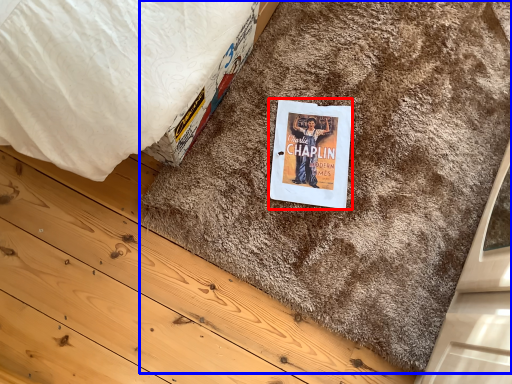
Question: Which of the following is the farthest to the observer, paperback book (highlighted by a red box) or doormat (highlighted by a blue box)?

Choices:
 (A) paperback book
 (B) doormat

Answer: (A)